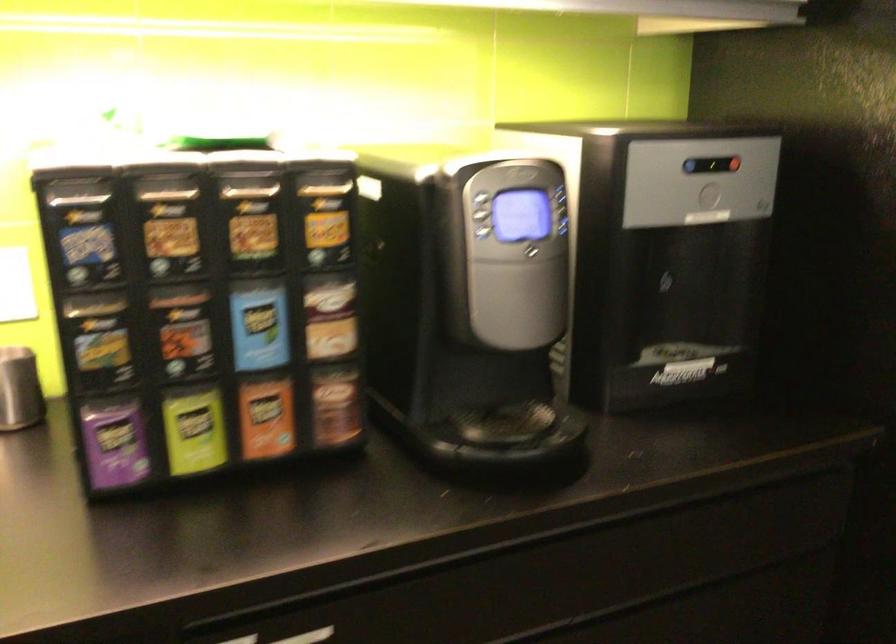
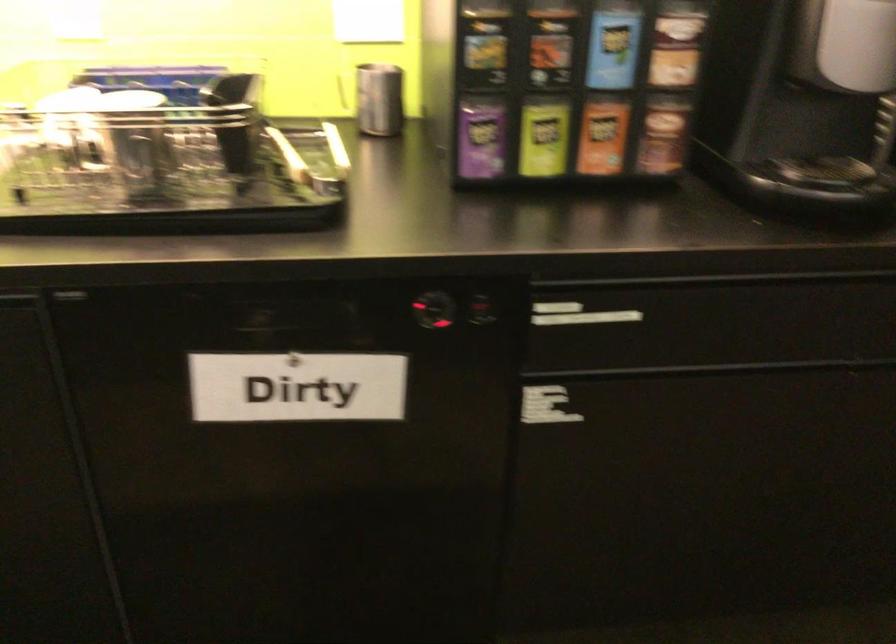
Find the pixel in the second image that matches point (257, 323) in the first image.

(613, 44)